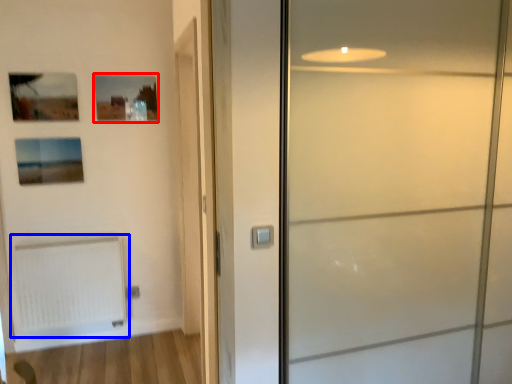
Question: Which object is further to the camera taking this photo, picture frame (highlighted by a red box) or radiator (highlighted by a blue box)?

Choices:
 (A) picture frame
 (B) radiator

Answer: (A)